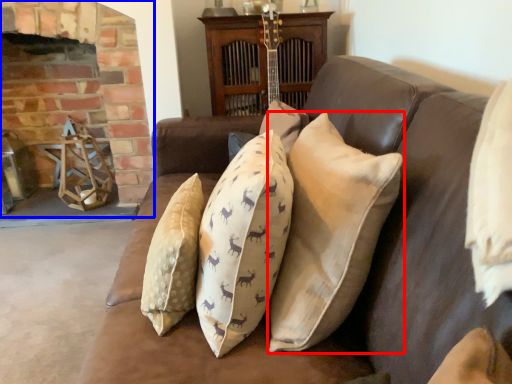
Question: Which point is further to the camera, pillow (highlighted by a red box) or fireplace (highlighted by a blue box)?

Choices:
 (A) pillow
 (B) fireplace

Answer: (B)